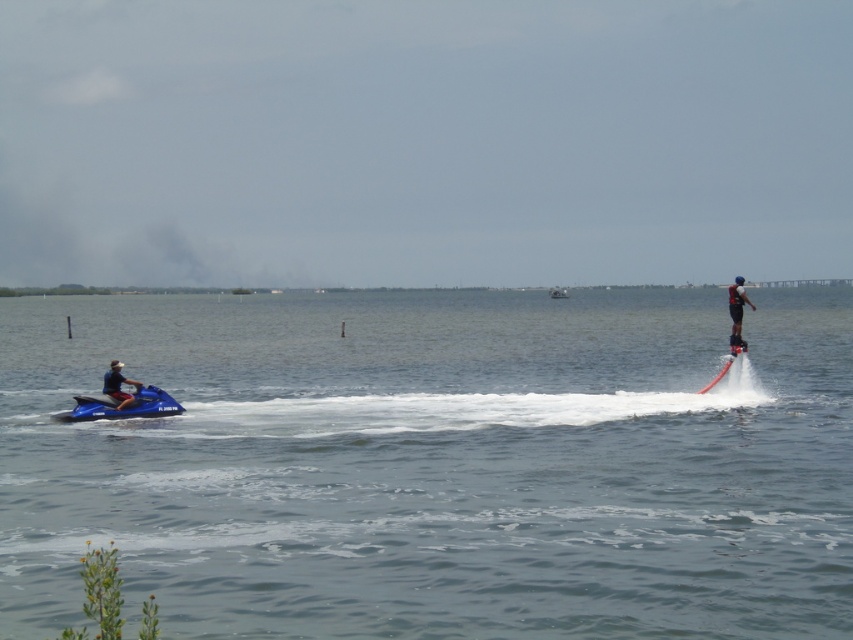
You are a safety officer observing the scene. You notice the clear water at jet ski left and the matte black jet ski at left. Which object is positioned higher in the image?

The clear water at jet ski left is located above the matte black jet ski at left, so it is positioned higher in the image.

From the picture: You are a photographer trying to capture the best shot of the black matte water skier at right. The photographer is positioned at the point with coordinates point (x=737, y=310). What is the spatial relationship between the photographer and the black matte water skier at right?

The point (x=737, y=310) indicates the location of the black matte water skier at right, so the photographer is positioned exactly where the black matte water skier at right is located.